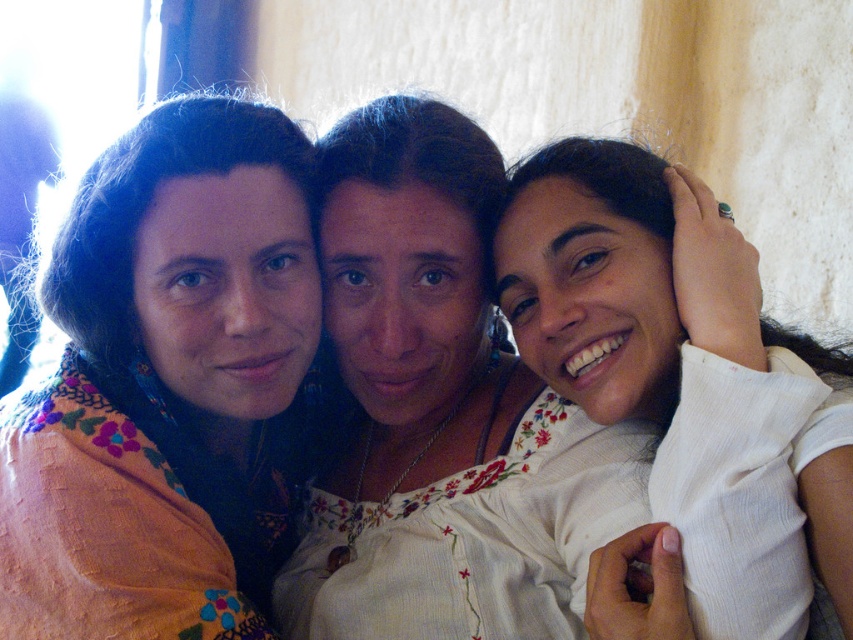
Can you confirm if embroidered fabric at center is wider than white embroidered blouse at center?

In fact, embroidered fabric at center might be narrower than white embroidered blouse at center.

Who is more forward, (10, 417) or (430, 204)?

Point (10, 417) is more forward.

Where is `embroidered fabric at center`? embroidered fabric at center is located at coordinates (161, 387).